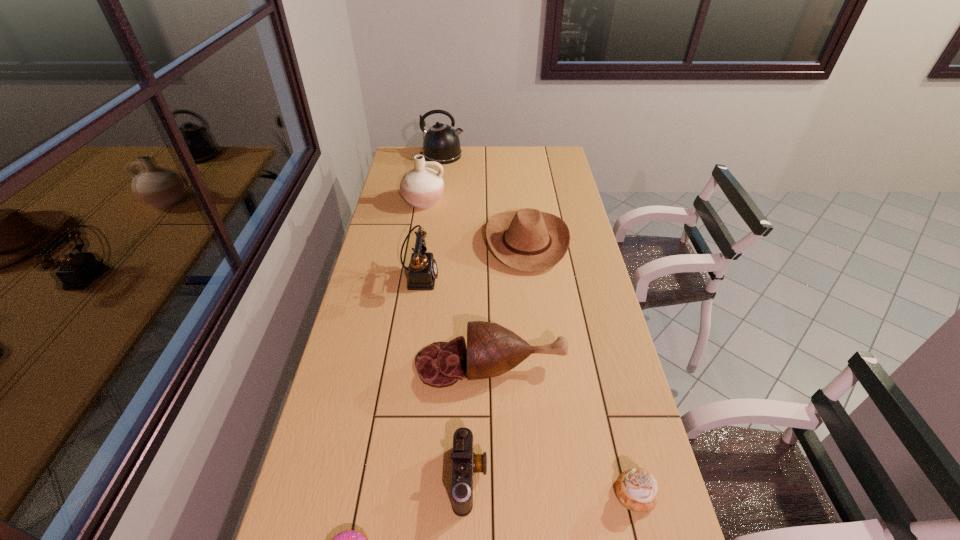
Find the location of a particular element. The image size is (960, 540). pottery situated at the left edge is located at coordinates (422, 187).

I want to click on telephone that is at the left edge, so click(422, 272).

Find the location of a particular element. This screenshot has height=540, width=960. cowboy hat situated at the right edge is located at coordinates (528, 240).

Where is `pastry that is at the right edge`? pastry that is at the right edge is located at coordinates (636, 489).

Locate an element on the screen. object that is at the far left corner is located at coordinates (441, 143).

This screenshot has height=540, width=960. In the image, there is a desktop. Find the location of `vacant space at the left edge`. vacant space at the left edge is located at coordinates (388, 373).

Identify the location of free space at the right edge of the desktop. Image resolution: width=960 pixels, height=540 pixels. (609, 355).

In the image, there is a desktop. Find the location of `free space at the far right corner`. free space at the far right corner is located at coordinates (550, 164).

At what (x,y) coordinates should I click in order to perform the action: click on free space that is in between the cowboy hat and the telephone. Please return your answer as a coordinate pair (x, y). This screenshot has height=540, width=960. Looking at the image, I should click on (473, 259).

Locate an element on the screen. The image size is (960, 540). unoccupied area between the fourth nearest object and the cowboy hat is located at coordinates (509, 303).